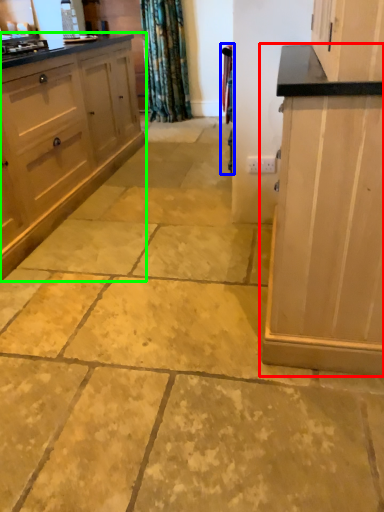
Question: Considering the real-world distances, which object is farthest from cabinetry (highlighted by a red box)? curtain (highlighted by a blue box) or cabinetry (highlighted by a green box)?

Choices:
 (A) curtain
 (B) cabinetry

Answer: (B)